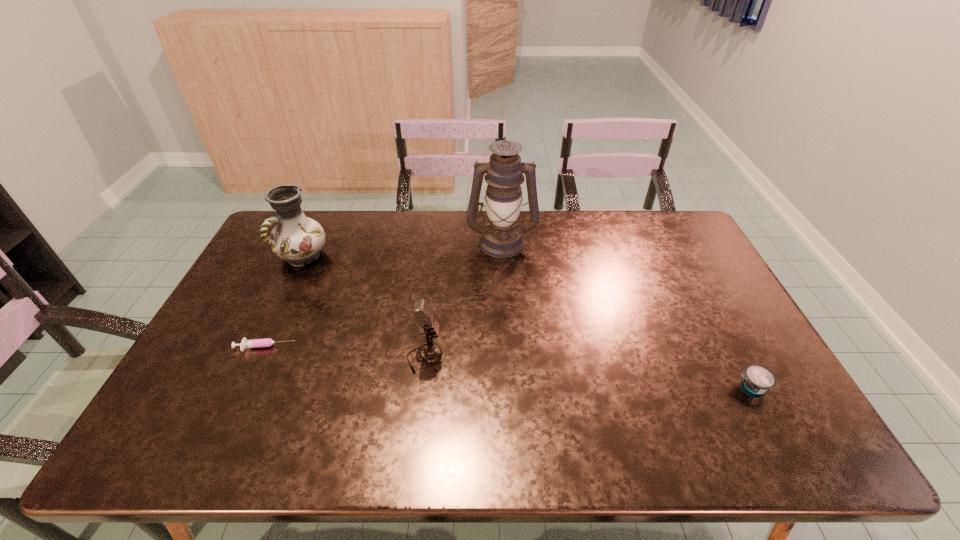
You are a GUI agent. You are given a task and a screenshot of the screen. Output one action in this format:
    pyautogui.click(x=<x>, y=<y>)
    Task: Click on the vacant region at the near edge
    The image size is (960, 540).
    Given the screenshot: What is the action you would take?
    pyautogui.click(x=387, y=460)

Identify the location of vacant space at the right edge of the desktop. The width and height of the screenshot is (960, 540). (705, 271).

Where is `unoccupied area between the oil lamp and the syringe`? The width and height of the screenshot is (960, 540). unoccupied area between the oil lamp and the syringe is located at coordinates (384, 295).

Identify the location of free space that is in between the vase and the yogurt. This screenshot has height=540, width=960. (527, 321).

The width and height of the screenshot is (960, 540). What are the coordinates of `unoccupied area between the third object from left to right and the syringe` in the screenshot? It's located at (346, 353).

Locate an element on the screen. Image resolution: width=960 pixels, height=540 pixels. empty space between the syringe and the third object from right to left is located at coordinates [346, 353].

Where is `free space that is in between the microphone and the vase`? The image size is (960, 540). free space that is in between the microphone and the vase is located at coordinates (365, 307).

Where is `vacant region between the yogurt and the vase`? vacant region between the yogurt and the vase is located at coordinates (527, 321).

Where is `empty location between the shortest object and the oil lamp`? empty location between the shortest object and the oil lamp is located at coordinates (384, 295).

This screenshot has height=540, width=960. In order to click on free spot between the vase and the tallest object in this screenshot , I will do `click(402, 249)`.